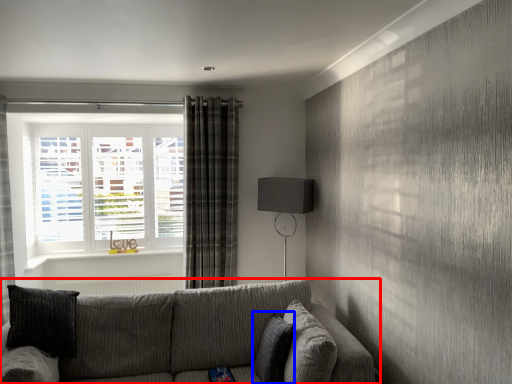
Question: Which of the following is the closest to the observer, studio couch (highlighted by a red box) or pillow (highlighted by a blue box)?

Choices:
 (A) studio couch
 (B) pillow

Answer: (A)